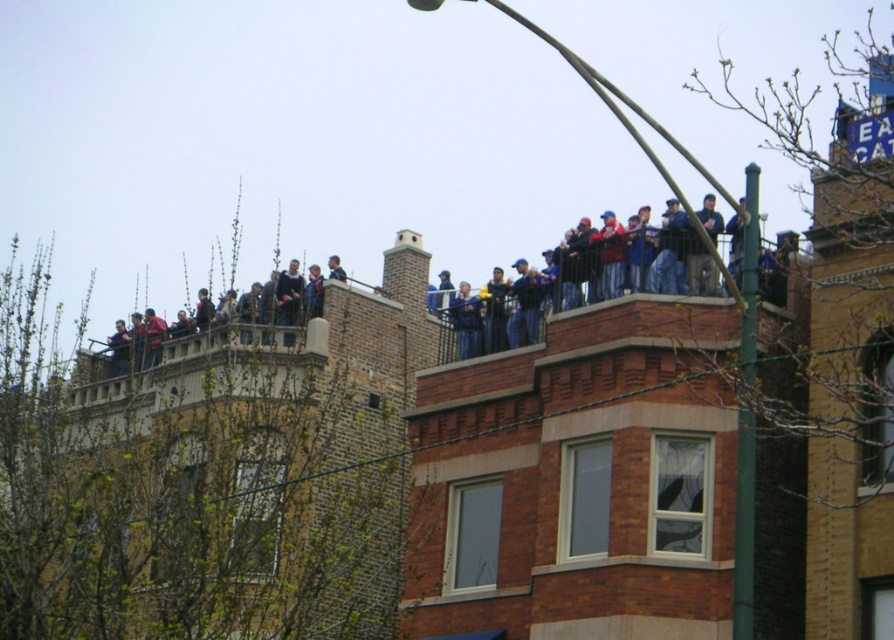
Question: Which point appears farthest from the camera in this image?

Choices:
 (A) (682, 634)
 (B) (153, 330)
 (C) (749, 211)

Answer: (B)

Question: Does dark blue jeans at upper center have a smaller size compared to blue denim jeans at upper center?

Choices:
 (A) no
 (B) yes

Answer: (A)

Question: Which point is farther from the camera taking this photo?

Choices:
 (A) (450, 316)
 (B) (659, 580)
 (C) (293, 272)

Answer: (C)

Question: Is green painted metal pole at upper right to the right of blue denim jeans at upper center from the viewer's perspective?

Choices:
 (A) yes
 (B) no

Answer: (A)

Question: Can you confirm if green painted metal pole at upper right is bigger than blue denim jeans at upper center?

Choices:
 (A) yes
 (B) no

Answer: (A)

Question: Considering the real-world distances, which object is closest to the green metallic pole at upper center?

Choices:
 (A) blue denim jeans at upper center
 (B) green painted metal pole at upper right

Answer: (B)